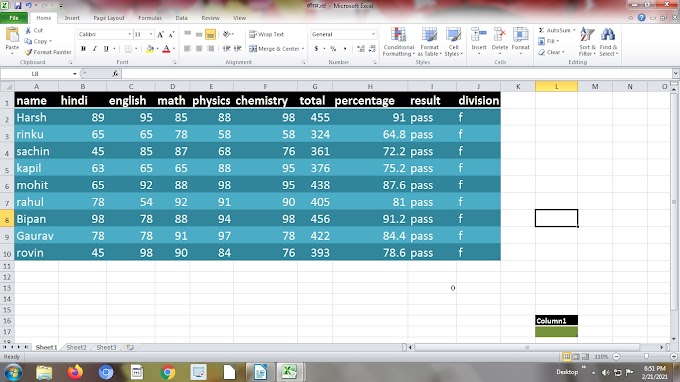
Image resolution: width=680 pixels, height=382 pixels. I want to click on row headers on the table, so click(18, 116), click(24, 135), click(29, 149), click(31, 99), click(31, 168), click(32, 181), click(32, 198), click(31, 218), click(34, 233), click(32, 253).